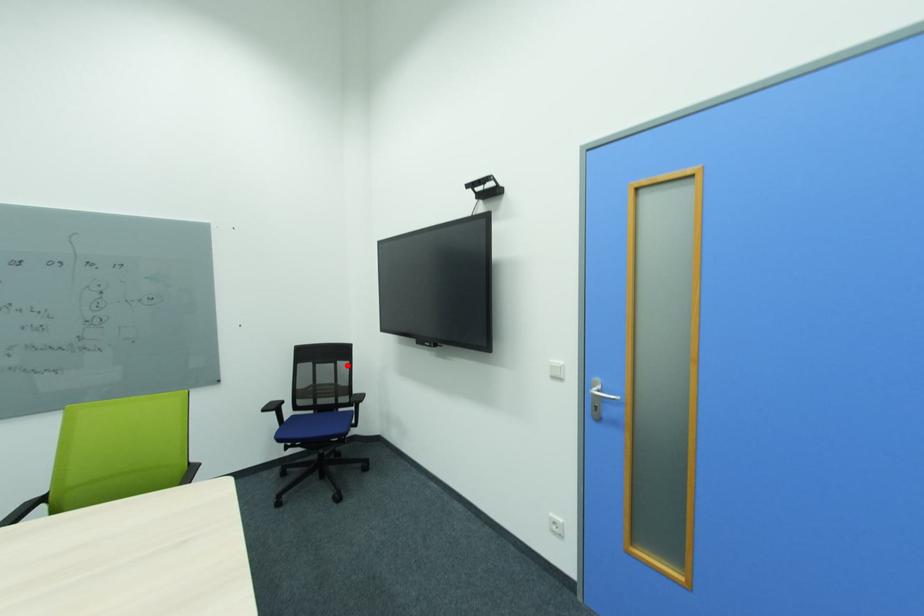
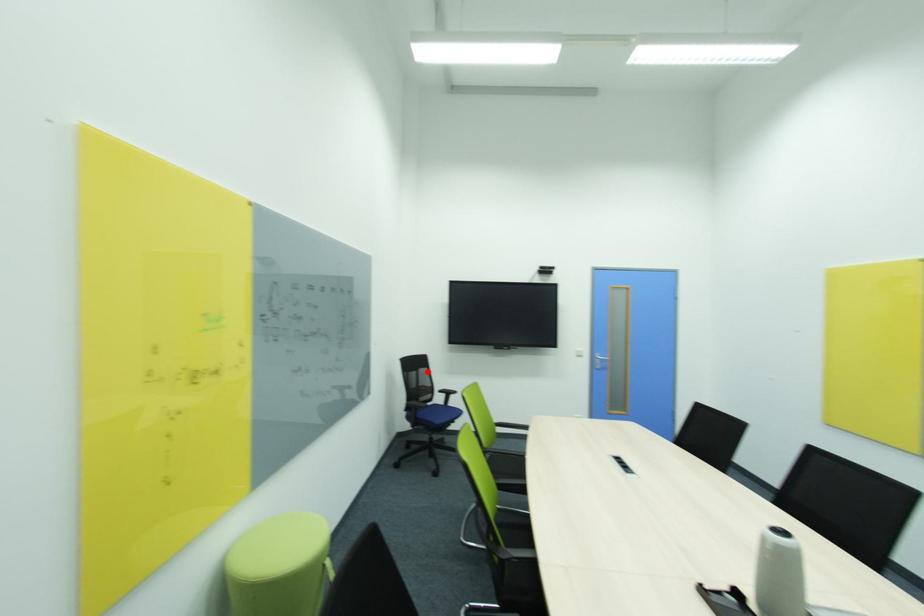
I am providing you with two images of the same scene from different viewpoints. A red point is marked on the first image and another point is marked on the second image. Does the point marked in image1 correspond to the same location as the one in image2?

Yes